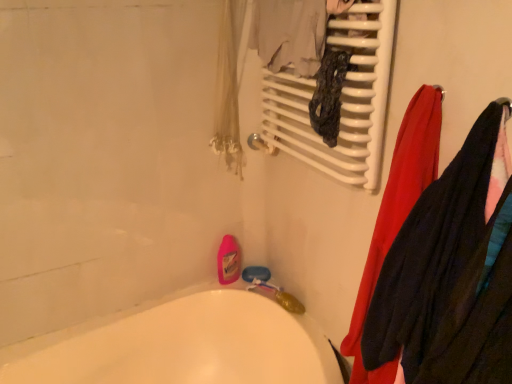
Question: Is white glossy bathtub at lower left outside of red fabric towel at right, the 2th clothing when ordered from right to left?

Choices:
 (A) yes
 (B) no

Answer: (A)

Question: From the image's perspective, is white glossy bathtub at lower left located beneath red fabric towel at right, the 1th clothing in the left-to-right sequence?

Choices:
 (A) no
 (B) yes

Answer: (B)

Question: Is white glossy bathtub at lower left facing away from red fabric towel at right, the 2th clothing when ordered from right to left?

Choices:
 (A) no
 (B) yes

Answer: (A)

Question: Can you confirm if white glossy bathtub at lower left is positioned to the left of red fabric towel at right, the 2th clothing when ordered from right to left?

Choices:
 (A) no
 (B) yes

Answer: (B)

Question: Considering the relative sizes of white glossy bathtub at lower left and red fabric towel at right, the 1th clothing in the left-to-right sequence, in the image provided, is white glossy bathtub at lower left wider than red fabric towel at right, the 1th clothing in the left-to-right sequence,?

Choices:
 (A) no
 (B) yes

Answer: (B)

Question: Considering the relative sizes of white glossy bathtub at lower left and red fabric towel at right, the 1th clothing in the left-to-right sequence, in the image provided, is white glossy bathtub at lower left bigger than red fabric towel at right, the 1th clothing in the left-to-right sequence,?

Choices:
 (A) yes
 (B) no

Answer: (A)

Question: From the image's perspective, would you say white glossy radiator at upper center is positioned over white glossy bathtub at lower left?

Choices:
 (A) no
 (B) yes

Answer: (B)

Question: Considering the relative positions of white glossy radiator at upper center and white glossy bathtub at lower left in the image provided, is white glossy radiator at upper center to the right of white glossy bathtub at lower left from the viewer's perspective?

Choices:
 (A) yes
 (B) no

Answer: (A)

Question: Does white glossy radiator at upper center have a smaller size compared to white glossy bathtub at lower left?

Choices:
 (A) yes
 (B) no

Answer: (A)

Question: Is white glossy radiator at upper center placed right next to white glossy bathtub at lower left?

Choices:
 (A) yes
 (B) no

Answer: (B)

Question: Is white glossy radiator at upper center not close to white glossy bathtub at lower left?

Choices:
 (A) yes
 (B) no

Answer: (B)

Question: Is the position of white glossy radiator at upper center more distant than that of white glossy bathtub at lower left?

Choices:
 (A) no
 (B) yes

Answer: (B)

Question: Is white glossy bathtub at lower left behind white glossy radiator at upper center?

Choices:
 (A) no
 (B) yes

Answer: (A)